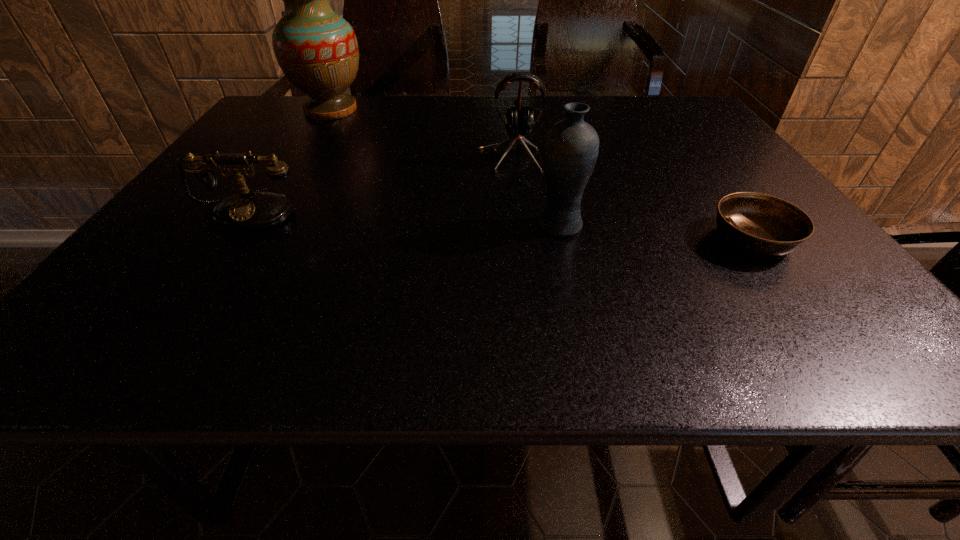
Identify the location of free space between the soup bowl and the earphone. The height and width of the screenshot is (540, 960). (631, 198).

What are the coordinates of `vacant point located between the tallest object and the telephone` in the screenshot? It's located at (291, 160).

Identify the location of free spot between the third tallest object and the farthest object. (420, 134).

The image size is (960, 540). Find the location of `object that is the fourth closest to the soup bowl`. object that is the fourth closest to the soup bowl is located at coordinates (317, 50).

Point out which object is positioned as the fourth nearest to the telephone. Please provide its 2D coordinates. Your answer should be formatted as a tuple, i.e. [(x, y)], where the tuple contains the x and y coordinates of a point satisfying the conditions above.

[(762, 224)]

Where is `blank area in the image that satisfies the following two spatial constraints: 1. on the dial of the right vase; 2. on the right side of the telephone`? Image resolution: width=960 pixels, height=540 pixels. blank area in the image that satisfies the following two spatial constraints: 1. on the dial of the right vase; 2. on the right side of the telephone is located at coordinates (242, 225).

Locate an element on the screen. free space in the image that satisfies the following two spatial constraints: 1. on the front side of the earphone; 2. on the right side of the right vase is located at coordinates (x=516, y=225).

At what (x,y) coordinates should I click in order to perform the action: click on free space that satisfies the following two spatial constraints: 1. on the dial of the telephone; 2. on the right side of the soup bowl. Please return your answer as a coordinate pair (x, y). The height and width of the screenshot is (540, 960). Looking at the image, I should click on 233,239.